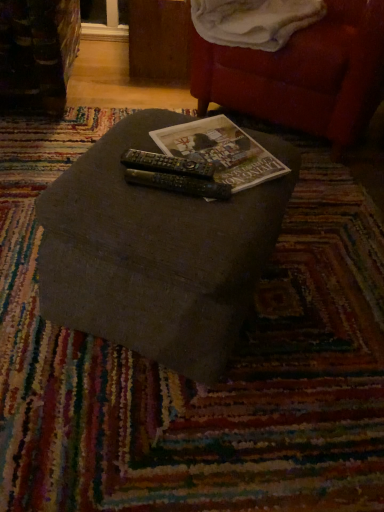
Identify the location of vacant space situated above textured gray ottoman at center (from a real-world perspective). (190, 150).